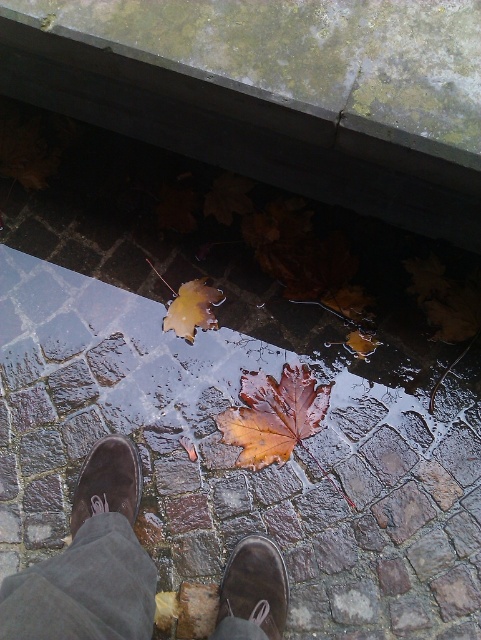
You are standing on the wet cobblestone pavement and see two points marked on the ground. The first point is at coordinates point (250, 381) and the second point is at point (191, 298). Which point is closer to your current position?

Point (250, 381) is closer to the viewer than point (191, 298).

Looking at this image, you are standing in a park and see two leaves on the ground, a brown matte leaf at center and a yellow matte maple leaf at center. You want to pick up both leaves but can only reach 25 centimeters. Can you reach both leaves without moving your feet?

The brown matte leaf at center is 26.78 centimeters from the yellow matte maple leaf at center, which is beyond your 25 centimeters reach. Therefore, you cannot reach both leaves without moving your feet.